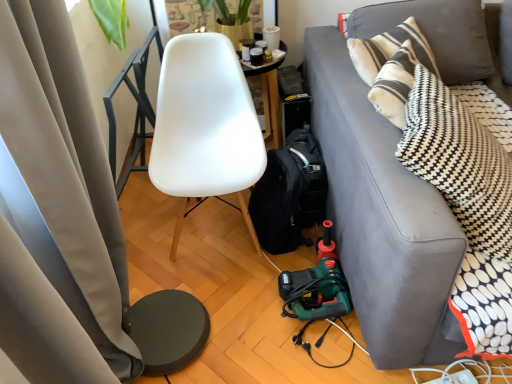
Where is `vacant space underneath white matte chair at center (from a real-world perspective)`? Image resolution: width=512 pixels, height=384 pixels. vacant space underneath white matte chair at center (from a real-world perspective) is located at coordinates (217, 231).